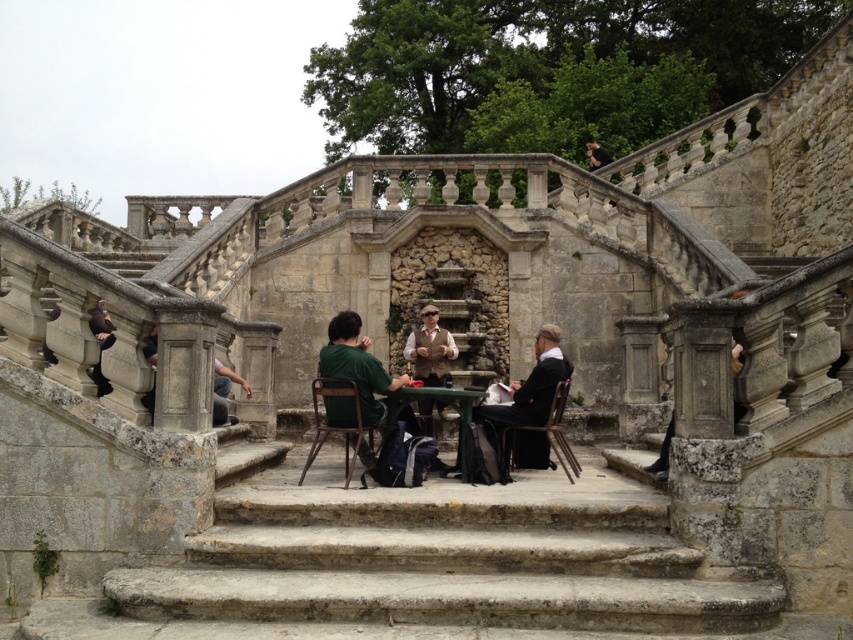
You are standing at the base of the stone staircase in the historical setting. You notice two points marked on the staircase. The first point is located at coordinates point (556, 380) and the second point is at point (347, 403). If you were to walk towards the staircase, which point would you encounter first?

Point (347, 403) would be encountered first because it is closer to the observer than point (556, 380), which is further away.

You are a photographer planning to take a group photo of the people around the green fabric shirt at center and the green matte table at center. Since both are green, you want to ensure they are distinguishable in the photo. Which object should you focus on to make sure it stands out more due to its size?

The green fabric shirt at center is bigger than the green matte table at center, so focusing on the green fabric shirt at center will make it stand out more due to its larger size.